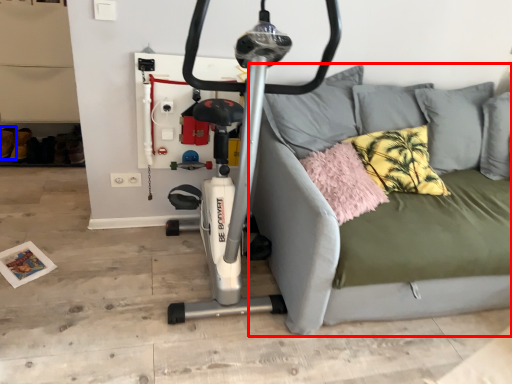
Question: Which of the following is the farthest to the observer, studio couch (highlighted by a red box) or shoe (highlighted by a blue box)?

Choices:
 (A) studio couch
 (B) shoe

Answer: (B)